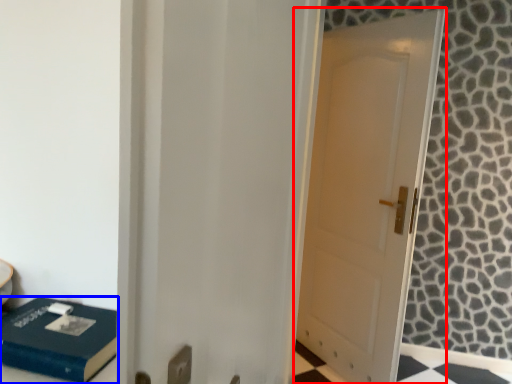
Question: Which point is closer to the camera, door (highlighted by a red box) or box (highlighted by a blue box)?

Choices:
 (A) door
 (B) box

Answer: (B)